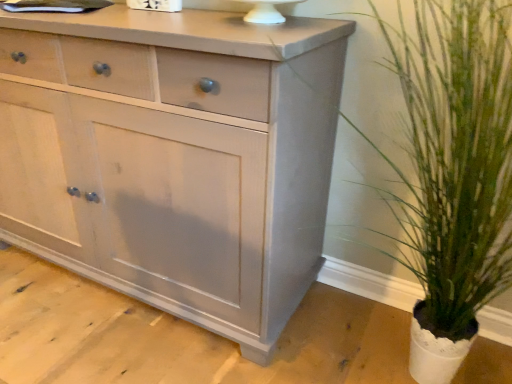
Question: From a real-world perspective, is matte gray cabinet at center positioned above or below green leafy plant at right?

Choices:
 (A) below
 (B) above

Answer: (A)

Question: Does point pos(281,274) appear closer or farther from the camera than point pos(420,114)?

Choices:
 (A) farther
 (B) closer

Answer: (A)

Question: From their relative heights in the image, would you say matte gray cabinet at center is taller or shorter than green leafy plant at right?

Choices:
 (A) tall
 (B) short

Answer: (A)

Question: Is green leafy plant at right wider or thinner than matte gray cabinet at center?

Choices:
 (A) thin
 (B) wide

Answer: (B)

Question: From the image's perspective, is green leafy plant at right positioned above or below matte gray cabinet at center?

Choices:
 (A) above
 (B) below

Answer: (B)

Question: Based on their sizes in the image, would you say green leafy plant at right is bigger or smaller than matte gray cabinet at center?

Choices:
 (A) small
 (B) big

Answer: (A)

Question: Is green leafy plant at right spatially inside matte gray cabinet at center, or outside of it?

Choices:
 (A) outside
 (B) inside

Answer: (A)